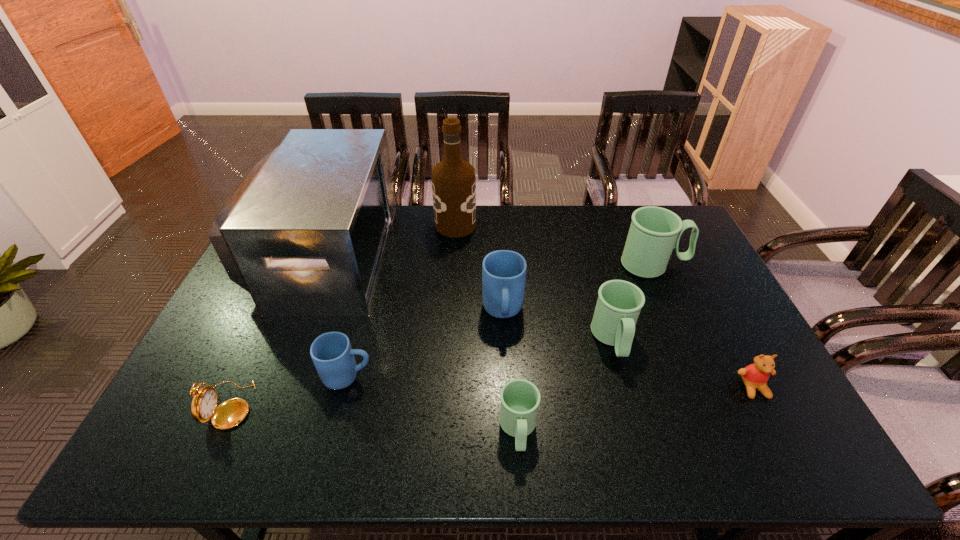
I want to click on mug that is at the right edge, so (654, 232).

Identify the location of teddy bear at the right edge. (755, 376).

Identify the location of object situated at the far left corner. This screenshot has width=960, height=540. (305, 234).

Image resolution: width=960 pixels, height=540 pixels. I want to click on object at the near left corner, so click(x=230, y=413).

In the image, there is a desktop. At what (x,y) coordinates should I click in order to perform the action: click on blank space at the far edge. Please return your answer as a coordinate pair (x, y). Looking at the image, I should click on (616, 226).

Image resolution: width=960 pixels, height=540 pixels. In the image, there is a desktop. Find the location of `vacant space at the near edge`. vacant space at the near edge is located at coordinates (657, 456).

Where is `free space at the right edge of the desktop`? Image resolution: width=960 pixels, height=540 pixels. free space at the right edge of the desktop is located at coordinates (742, 406).

At what (x,y) coordinates should I click in order to perform the action: click on unoccupied position between the microwave oven and the right blue mug. Please return your answer as a coordinate pair (x, y). Image resolution: width=960 pixels, height=540 pixels. Looking at the image, I should click on (414, 283).

At what (x,y) coordinates should I click in order to perform the action: click on free space between the farther blue mug and the smallest green mug. Please return your answer as a coordinate pair (x, y). Looking at the image, I should click on (511, 371).

The width and height of the screenshot is (960, 540). I want to click on free space that is in between the second green mug from left to right and the smaller blue mug, so click(x=481, y=358).